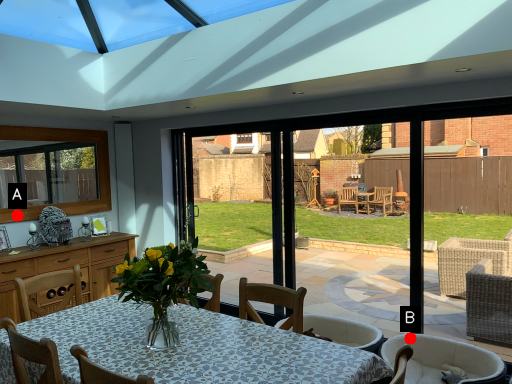
Question: Two points are circled on the image, labeled by A and B beside each circle. Which point appears closest to the camera in this image?

Choices:
 (A) A is closer
 (B) B is closer

Answer: (B)